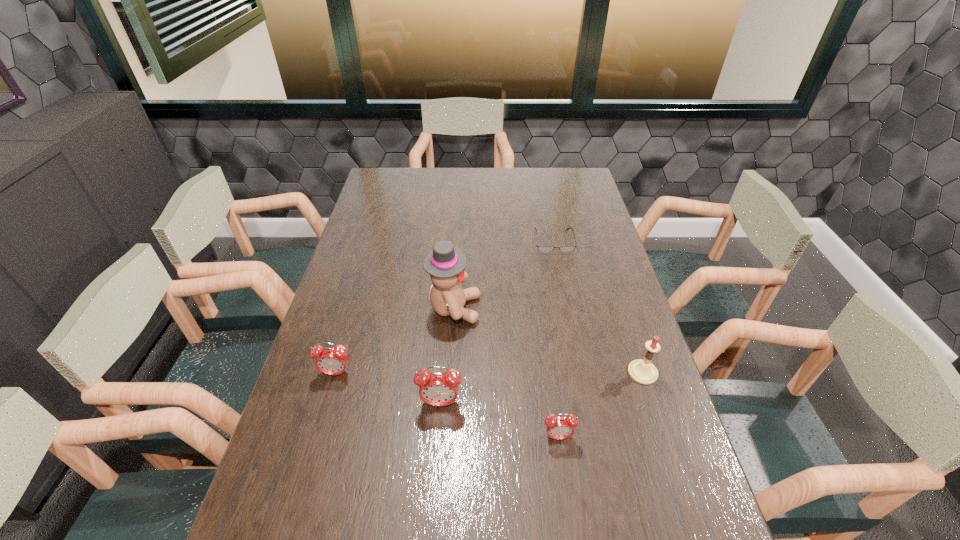
Where is `the shortest object`? The image size is (960, 540). the shortest object is located at coordinates (541, 248).

Find the location of `vacant area situated 0.330m on the face of the farthest alarm clock`. vacant area situated 0.330m on the face of the farthest alarm clock is located at coordinates (296, 512).

Locate an element on the screen. The width and height of the screenshot is (960, 540). free space located on the face of the fifth farthest object is located at coordinates (433, 495).

At what (x,y) coordinates should I click in order to perform the action: click on free space located on the face of the rightmost alarm clock. Please return your answer as a coordinate pair (x, y). The image size is (960, 540). Looking at the image, I should click on 569,516.

At what (x,y) coordinates should I click in order to perform the action: click on vacant space situated 0.100m on the back of the candle. Please return your answer as a coordinate pair (x, y). The image size is (960, 540). Looking at the image, I should click on (630, 333).

Identify the location of free space located 0.240m on the front-facing side of the tallest object. click(559, 309).

Locate an element on the screen. The image size is (960, 540). free region located on the front-facing side of the farthest object is located at coordinates (564, 289).

The width and height of the screenshot is (960, 540). Identify the location of object that is positioned at the left edge. (332, 361).

At what (x,y) coordinates should I click in order to perform the action: click on candle positioned at the right edge. Please return your answer as a coordinate pair (x, y). Looking at the image, I should click on (642, 371).

This screenshot has width=960, height=540. I want to click on spectacles that is at the right edge, so click(541, 248).